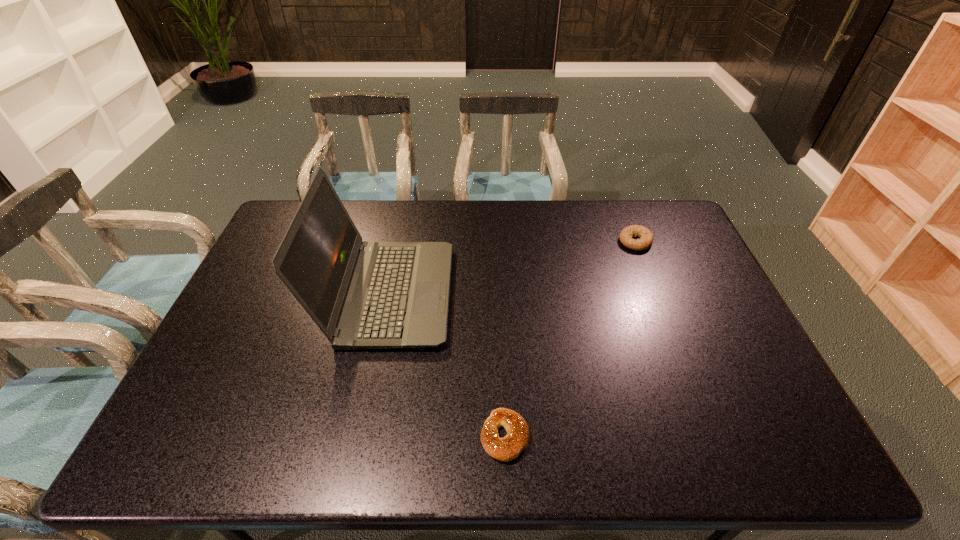
The height and width of the screenshot is (540, 960). I want to click on free spot between the nearer bagel and the laptop_computer, so click(446, 365).

The height and width of the screenshot is (540, 960). I want to click on vacant point located between the laptop_computer and the nearest object, so click(446, 365).

Where is `vacant area that lies between the right bagel and the second object from right to left`? vacant area that lies between the right bagel and the second object from right to left is located at coordinates (570, 339).

You are a GUI agent. You are given a task and a screenshot of the screen. Output one action in this format:
    pyautogui.click(x=<x>, y=<y>)
    Task: Click on the free space between the rightmost object and the nearest object
    This screenshot has width=960, height=540.
    Given the screenshot: What is the action you would take?
    pyautogui.click(x=570, y=339)

Identify the location of vacant region between the left bagel and the rightmost object. (570, 339).

The image size is (960, 540). Identify the location of vacant space that's between the farther bagel and the tallest object. (512, 268).

You are a GUI agent. You are given a task and a screenshot of the screen. Output one action in this format:
    pyautogui.click(x=<x>, y=<y>)
    Task: Click on the free point between the leftmost object and the right bagel
    
    Given the screenshot: What is the action you would take?
    pyautogui.click(x=512, y=268)

Select which object appears as the second closest to the nearer bagel. Please provide its 2D coordinates. Your answer should be formatted as a tuple, i.e. [(x, y)], where the tuple contains the x and y coordinates of a point satisfying the conditions above.

[(646, 239)]

Point out which object is positioned as the second nearest to the farther bagel. Please provide its 2D coordinates. Your answer should be formatted as a tuple, i.e. [(x, y)], where the tuple contains the x and y coordinates of a point satisfying the conditions above.

[(508, 448)]

Identify the location of free space in the image that satisfies the following two spatial constraints: 1. on the front side of the rightmost object; 2. on the screen of the laptop_computer. This screenshot has width=960, height=540. (657, 294).